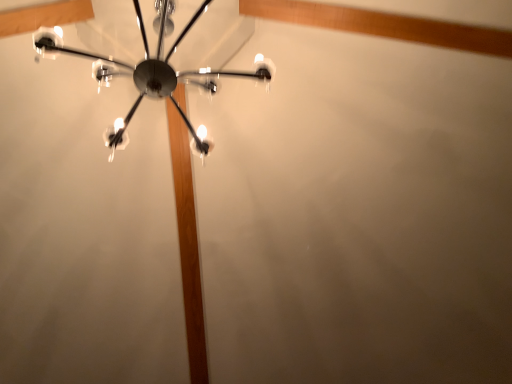
What do you see at coordinates (146, 71) in the screenshot? This screenshot has width=512, height=384. I see `metallic chandelier at upper left` at bounding box center [146, 71].

Measure the distance between metallic chandelier at upper left and camera.

A distance of 5.89 feet exists between metallic chandelier at upper left and camera.

Where is `metallic chandelier at upper left`? This screenshot has width=512, height=384. metallic chandelier at upper left is located at coordinates (146, 71).

The height and width of the screenshot is (384, 512). In order to click on metallic chandelier at upper left in this screenshot , I will do `click(146, 71)`.